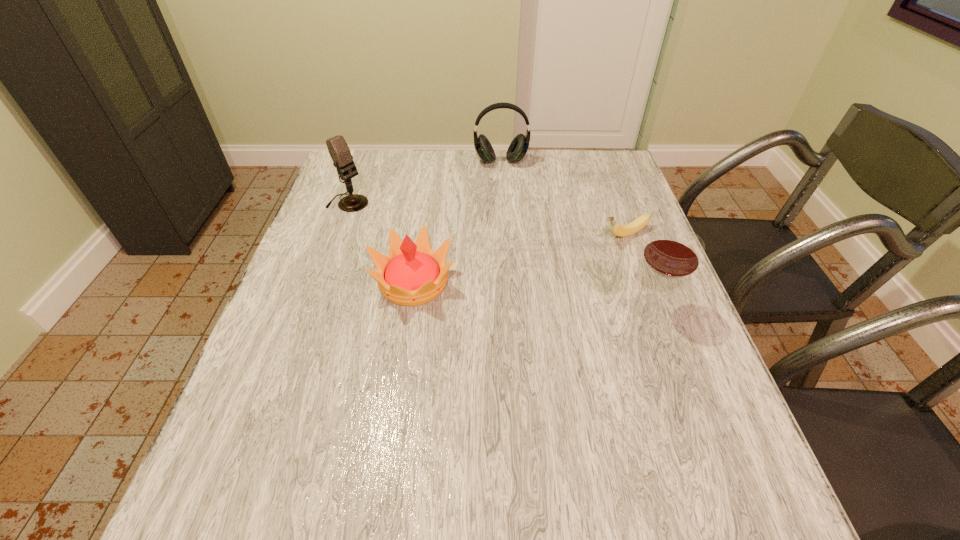
At what (x,y) coordinates should I click in order to perform the action: click on vacant space on the desktop that is between the second object from left to right and the wineglass and is positioned on the front-facing side of the leftmost object. Please return your answer as a coordinate pair (x, y). Looking at the image, I should click on (496, 291).

I want to click on vacant space on the desktop that is between the crown and the wineglass and is positioned on the ear cups of the farthest object, so pos(516,293).

The image size is (960, 540). Identify the location of vacant space on the desktop that is between the crown and the wineglass and is positioned at the stem of the banana. (494, 291).